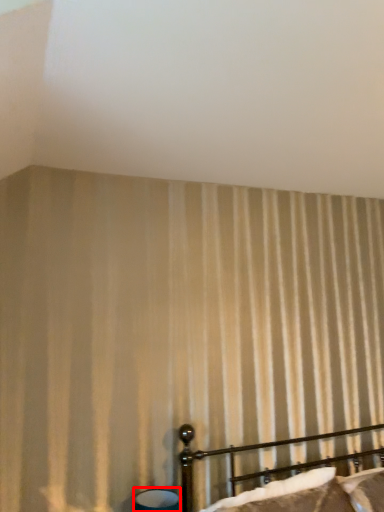
Question: From the image's perspective, where is table lamp (annotated by the red box) located relative to bed?

Choices:
 (A) below
 (B) above

Answer: (A)